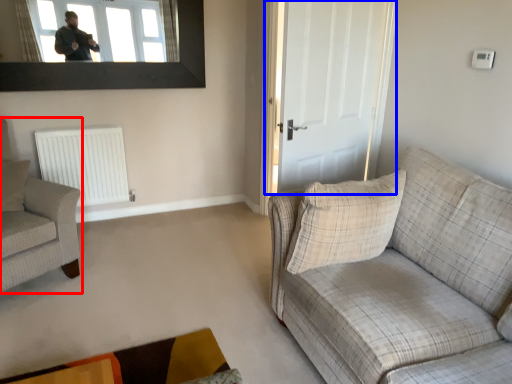
Question: Which of the following is the farthest to the observer, chair (highlighted by a red box) or door (highlighted by a blue box)?

Choices:
 (A) chair
 (B) door

Answer: (B)